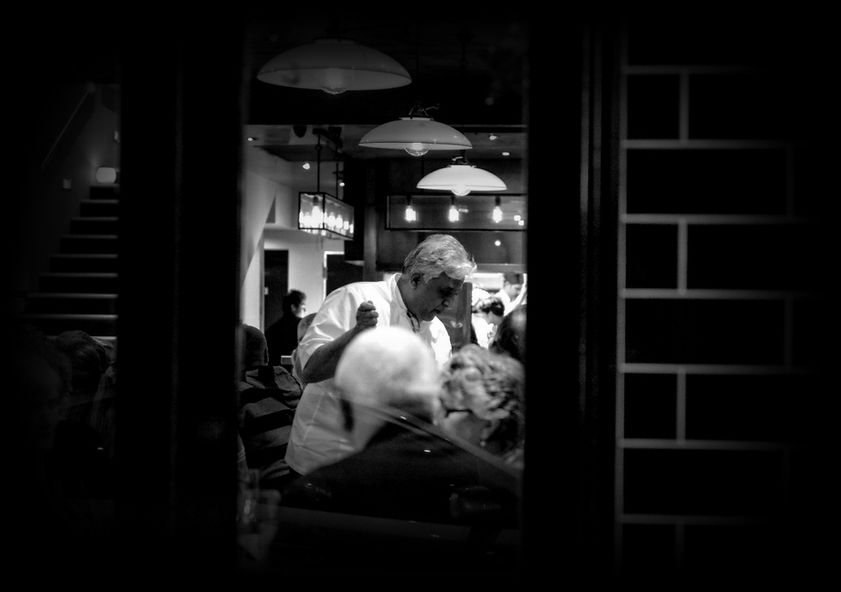
The width and height of the screenshot is (841, 592). I want to click on window, so click(369, 347).